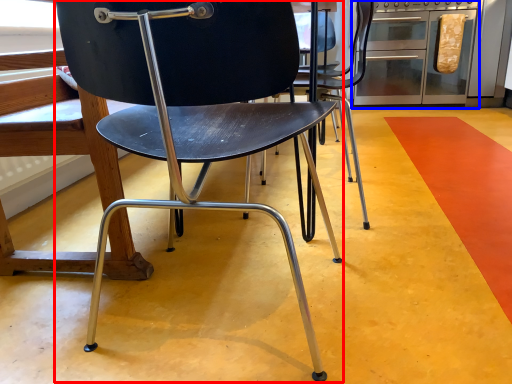
Question: Which point is closer to the camera, chair (highlighted by a red box) or oven (highlighted by a blue box)?

Choices:
 (A) chair
 (B) oven

Answer: (A)